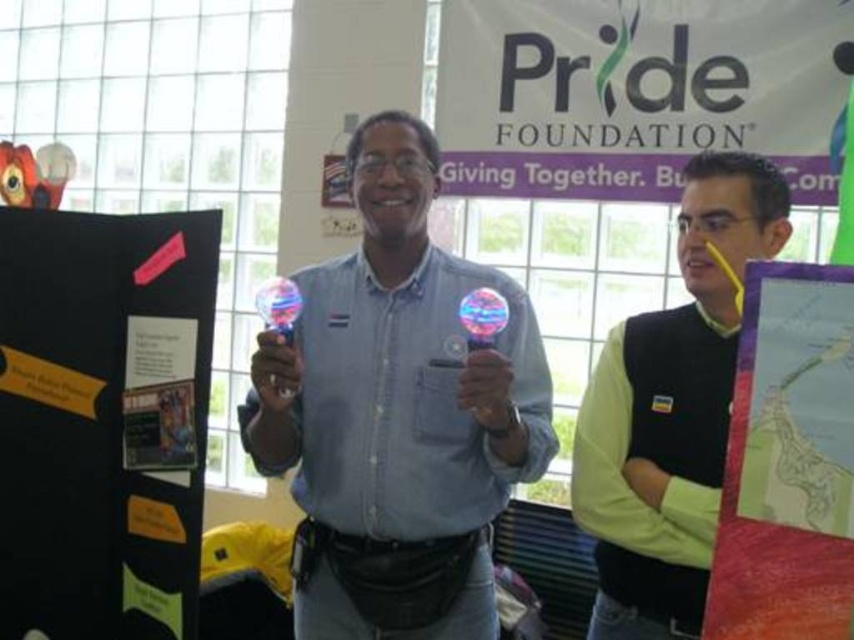
Question: Does blue fabric shirt at center have a lesser width compared to black cardboard at left?

Choices:
 (A) no
 (B) yes

Answer: (A)

Question: Based on their relative distances, which object is farther from the green matte vest at center?

Choices:
 (A) blue fabric shirt at center
 (B) black cardboard at left
 (C) map paper at right

Answer: (B)

Question: Among these points, which one is farthest from the camera?

Choices:
 (A) (816, 339)
 (B) (396, 176)
 (C) (686, 272)
 (D) (31, 449)

Answer: (D)

Question: Among these points, which one is farthest from the camera?

Choices:
 (A) (120, 595)
 (B) (647, 627)
 (C) (454, 420)
 (D) (834, 342)

Answer: (A)

Question: In this image, where is green matte vest at center located relative to map paper at right?

Choices:
 (A) left
 (B) right

Answer: (B)

Question: Considering the relative positions of blue fabric shirt at center and map paper at right in the image provided, where is blue fabric shirt at center located with respect to map paper at right?

Choices:
 (A) right
 (B) left

Answer: (B)